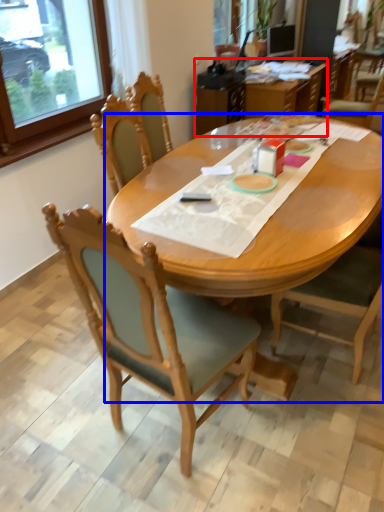
Question: Which object is closer to the camera taking this photo, table (highlighted by a red box) or desk (highlighted by a blue box)?

Choices:
 (A) table
 (B) desk

Answer: (B)